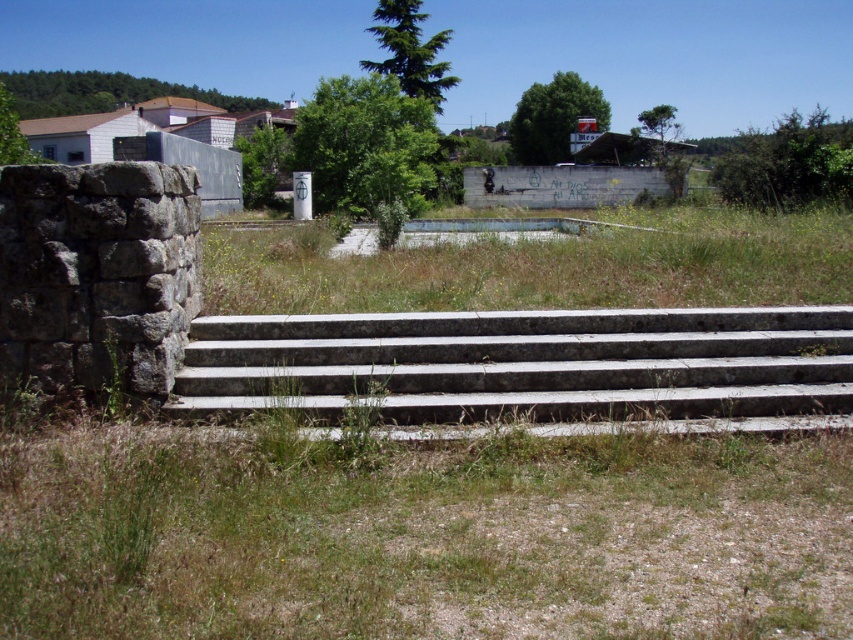
Question: Does gray concrete stairs at center appear over green grass at center?

Choices:
 (A) no
 (B) yes

Answer: (A)

Question: Does gray concrete stairs at center appear under green grass at center?

Choices:
 (A) no
 (B) yes

Answer: (B)

Question: Which point is closer to the camera?

Choices:
 (A) (593, 326)
 (B) (740, 284)

Answer: (A)

Question: Which object is closer to the camera taking this photo?

Choices:
 (A) gray concrete stairs at center
 (B) green grass at center

Answer: (A)

Question: Does gray concrete stairs at center have a greater width compared to green grass at center?

Choices:
 (A) yes
 (B) no

Answer: (B)

Question: Among these points, which one is nearest to the camera?

Choices:
 (A) (503, 250)
 (B) (529, 365)

Answer: (B)